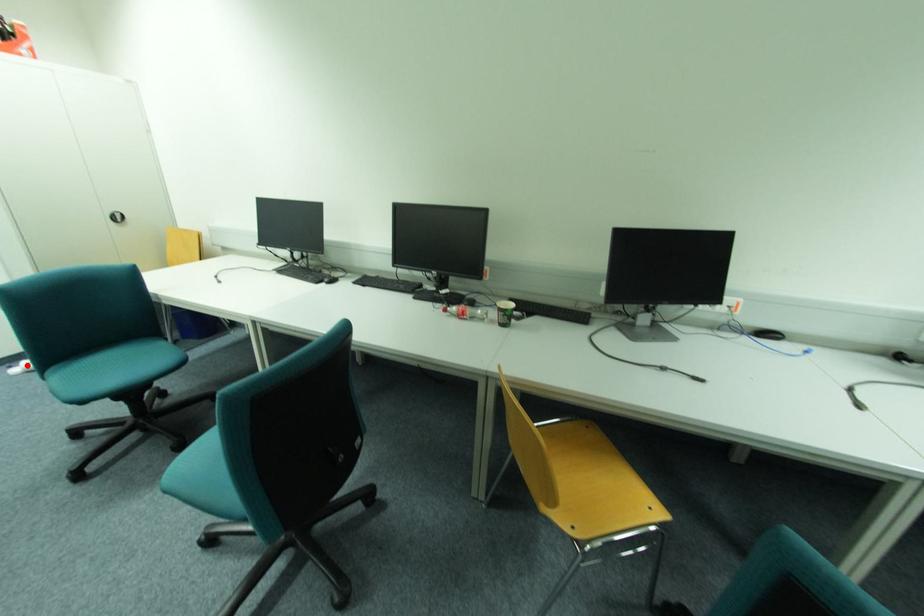
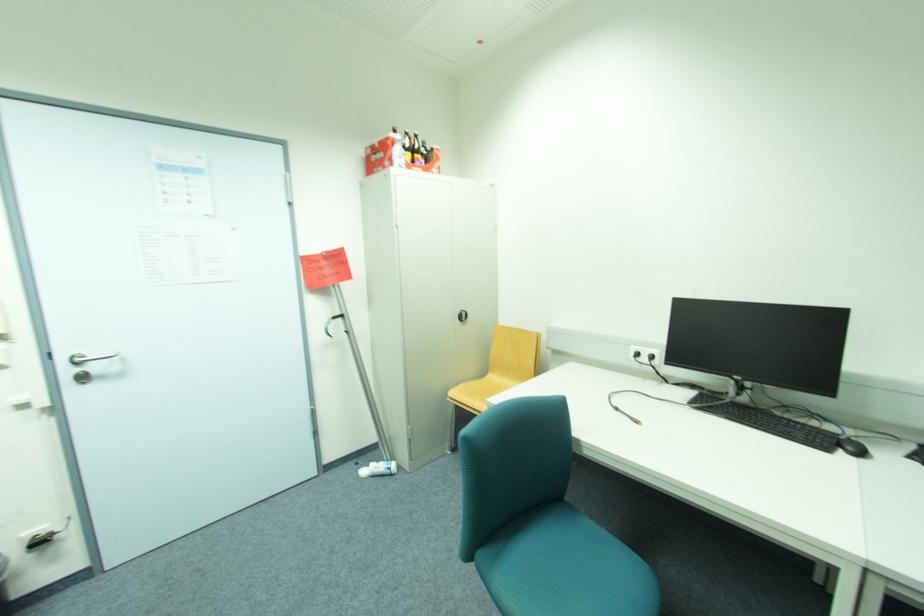
Question: I am providing you with two images of the same scene from different viewpoints. Given a red point in image1, look at the same physical point in image2. Is it:

Choices:
 (A) Closer to the viewpoint
 (B) Farther from the viewpoint

Answer: (B)